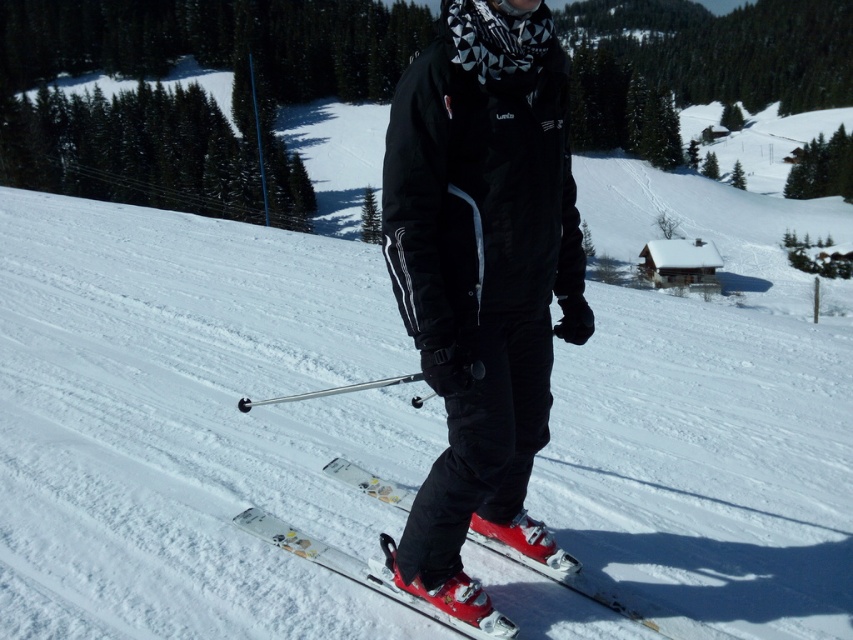
Between point (473, 179) and point (451, 612), which one is positioned behind?

Positioned behind is point (451, 612).

Can you confirm if matte black ski suit at center is bigger than white glossy skis at center?

Correct, matte black ski suit at center is larger in size than white glossy skis at center.

At what (x,y) coordinates should I click in order to perform the action: click on matte black ski suit at center. Please return your answer as a coordinate pair (x, y). Looking at the image, I should click on (482, 276).

Is white powder snow at center positioned before white glossy skis at center?

No.

Does white powder snow at center appear under white glossy skis at center?

Actually, white powder snow at center is above white glossy skis at center.

Measure the distance between point (4, 317) and camera.

A distance of 8.83 meters exists between point (4, 317) and camera.

Image resolution: width=853 pixels, height=640 pixels. I want to click on white powder snow at center, so pos(190,422).

At what (x,y) coordinates should I click in order to perform the action: click on white powder snow at center. Please return your answer as a coordinate pair (x, y). The height and width of the screenshot is (640, 853). Looking at the image, I should click on (190, 422).

What do you see at coordinates (190, 422) in the screenshot? I see `white powder snow at center` at bounding box center [190, 422].

Is point (372, 346) positioned behind point (540, 17)?

Yes, point (372, 346) is farther from viewer.

Locate an element on the screen. The height and width of the screenshot is (640, 853). white powder snow at center is located at coordinates (190, 422).